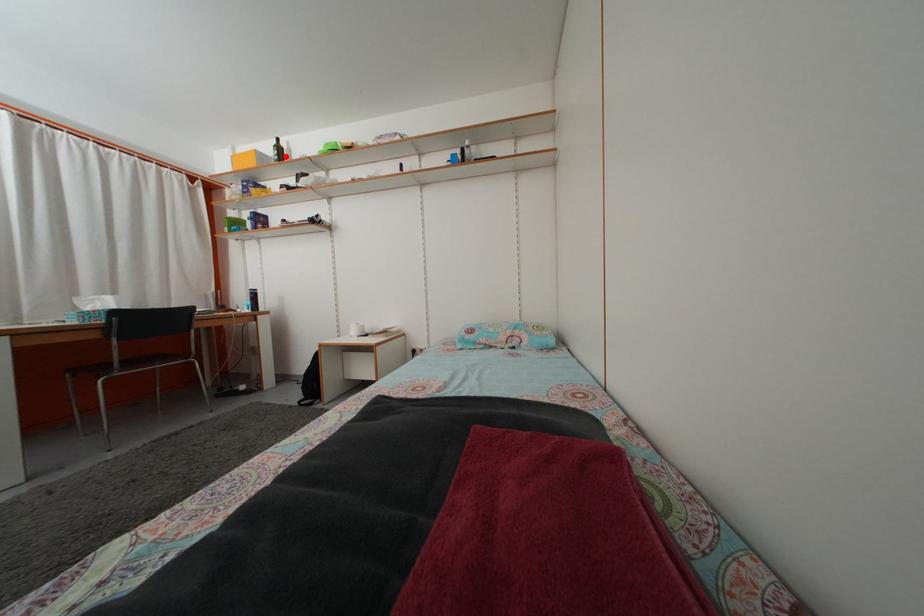
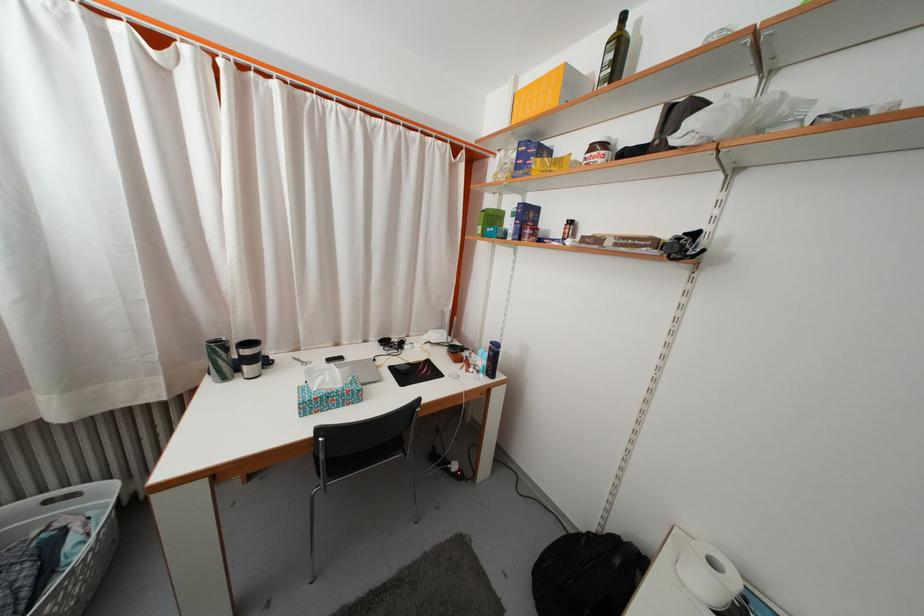
Question: I am providing you with two images of the same scene from different viewpoints. Image1 has a red point marked. In image2, the corresponding 3D location appears at what relative position? Reply with the corresponding letter.

Choices:
 (A) Closer
 (B) Farther

Answer: (B)